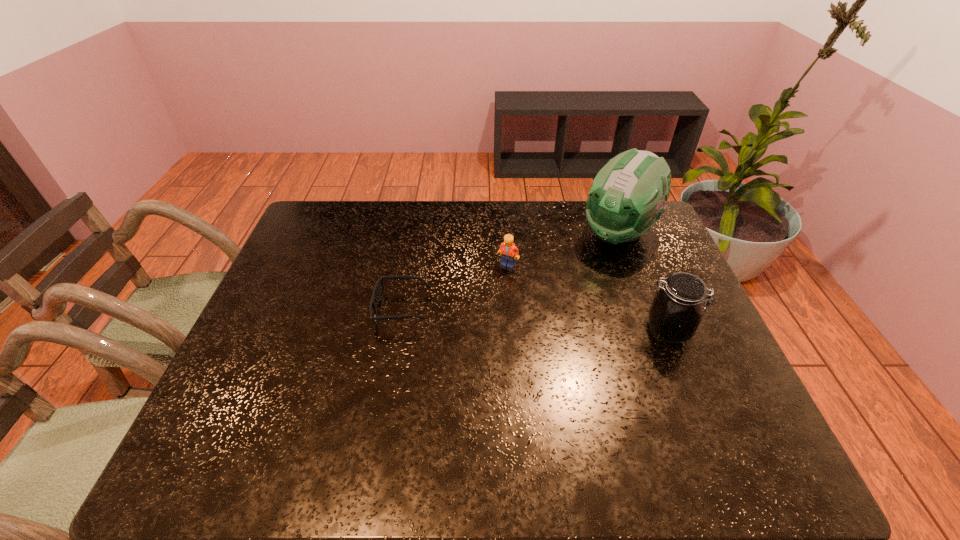
You are a GUI agent. You are given a task and a screenshot of the screen. Output one action in this format:
    pyautogui.click(x=<x>, y=<y>)
    Task: Click on the vacant space on the desktop that is between the sunglasses and the jar and is positioned on the front-facing side of the Lego
    Image resolution: width=960 pixels, height=540 pixels.
    Given the screenshot: What is the action you would take?
    click(x=502, y=317)

The width and height of the screenshot is (960, 540). I want to click on vacant space on the desktop that is between the shortest object and the third shortest object and is positioned on the visor of the football helmet, so [x=532, y=320].